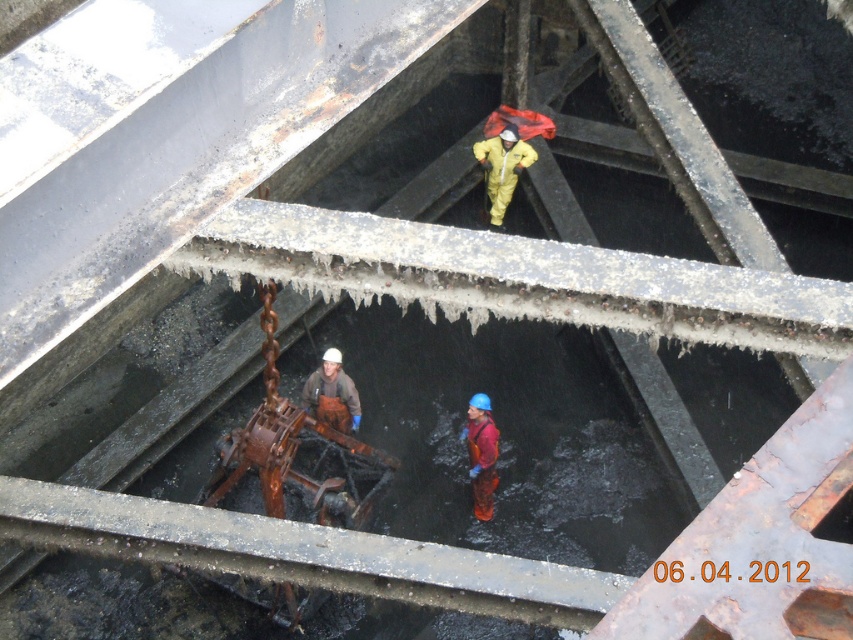
Consider the image. You are a safety inspector evaluating the workspace. You notice the brown leather boots at center and the red rubber suit at center. Which object has a greater width according to the description?

The brown leather boots at center might be wider than the red rubber suit at center according to the description.

You are a worker in the industrial facility and need to move from the point at coordinates point (357, 428) to the point at coordinates point (485, 458). Which direction should you move to reach your destination?

Since point (357, 428) is behind point (485, 458), you should move forward to reach the destination.

You are a safety inspector in this industrial facility. You need to ensure that the yellow matte suit at center and the brown leather boots at center are within the minimum safety distance of 2 meters apart. Can you confirm if they are compliant with the safety regulations?

The distance between the yellow matte suit at center and the brown leather boots at center is 2.20 meters, which exceeds the minimum required safety distance of 2 meters. Therefore, they are compliant with the safety regulations.